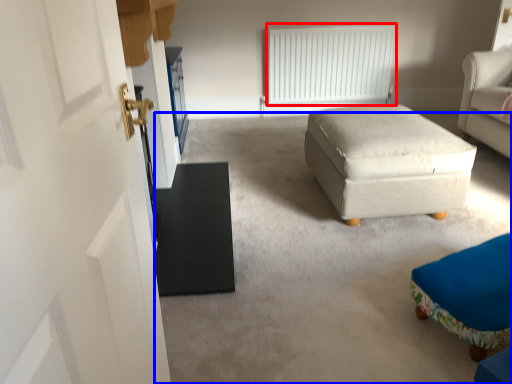
Question: Which point is closer to the camera, radiator (highlighted by a red box) or plain (highlighted by a blue box)?

Choices:
 (A) radiator
 (B) plain

Answer: (B)